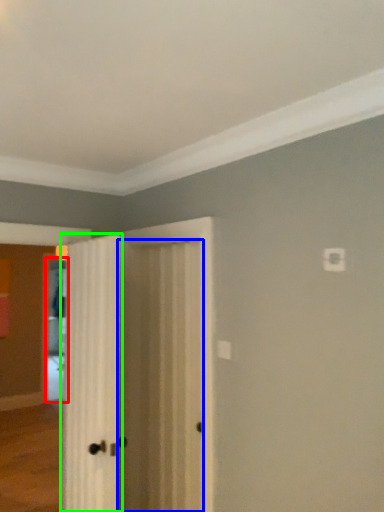
Question: Which object is the farthest from screen door (highlighted by a red box)? Choose among these: door (highlighted by a blue box) or door (highlighted by a green box).

Choices:
 (A) door
 (B) door

Answer: (B)